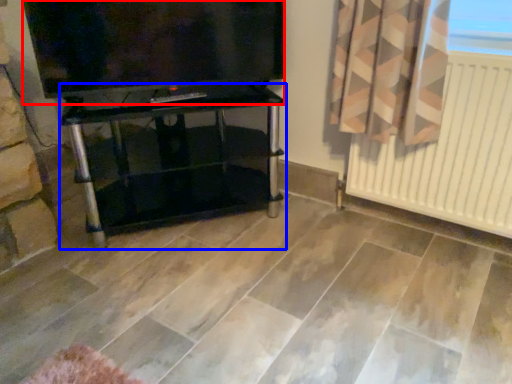
Question: Which object is closer to the camera taking this photo, television (highlighted by a red box) or furniture (highlighted by a blue box)?

Choices:
 (A) television
 (B) furniture

Answer: (A)